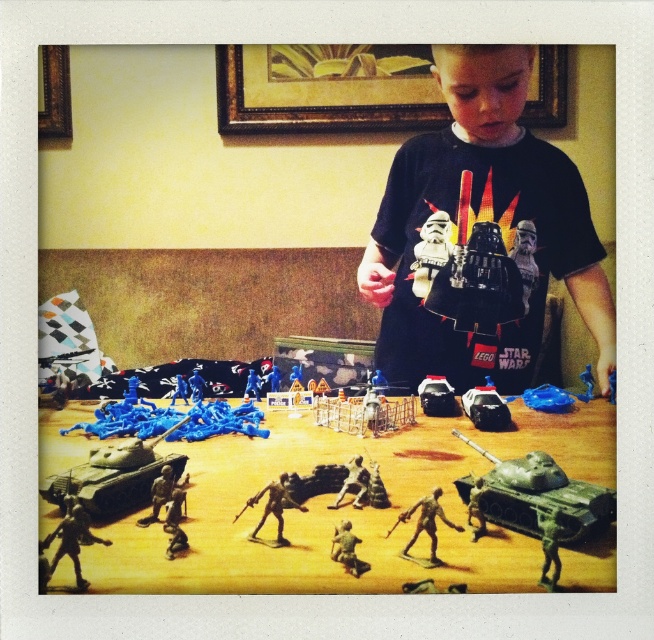
Question: Which object is closer to the camera taking this photo?

Choices:
 (A) wooden frame at upper left
 (B) metallic silver soldier at lower left

Answer: (B)

Question: Is wooden frame at upper left thinner than metallic silver soldier at center?

Choices:
 (A) yes
 (B) no

Answer: (B)

Question: Which of the following is the closest to the observer?

Choices:
 (A) (523, 486)
 (B) (273, 493)

Answer: (B)

Question: Is metallic silver soldier at lower left below metallic silver soldier at center?

Choices:
 (A) no
 (B) yes

Answer: (A)

Question: Is wooden frame at upper left thinner than green plastic tank at center?

Choices:
 (A) no
 (B) yes

Answer: (A)

Question: Which of the following is the closest to the observer?

Choices:
 (A) green plastic tank at center
 (B) black matte t-shirt at center
 (C) wooden picture frame at upper center
 (D) green plastic soldier at center

Answer: (D)